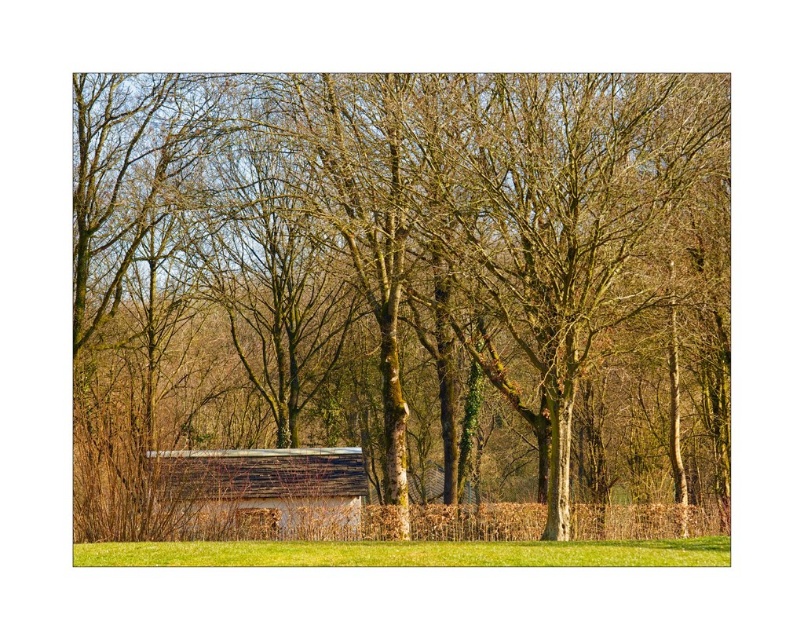
Question: Does brown bark tree at center have a larger size compared to green grass at lower center?

Choices:
 (A) no
 (B) yes

Answer: (B)

Question: In this image, where is wooden hut at center located relative to green grass at lower center?

Choices:
 (A) left
 (B) right

Answer: (A)

Question: Which of the following is the farthest from the observer?

Choices:
 (A) (170, 484)
 (B) (661, 468)

Answer: (B)

Question: Which of these objects is positioned closest to the wooden hut at center?

Choices:
 (A) green grass at lower center
 (B) brown bark tree at center

Answer: (B)

Question: Among these objects, which one is farthest from the camera?

Choices:
 (A) brown bark tree at center
 (B) green grass at lower center

Answer: (A)

Question: Does wooden hut at center appear on the right side of green grass at lower center?

Choices:
 (A) yes
 (B) no

Answer: (B)